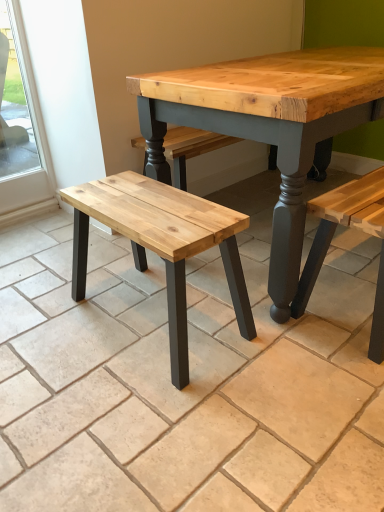
Image resolution: width=384 pixels, height=512 pixels. In order to click on empty space that is to the right of natural wood bench at left in this screenshot , I will do `click(292, 325)`.